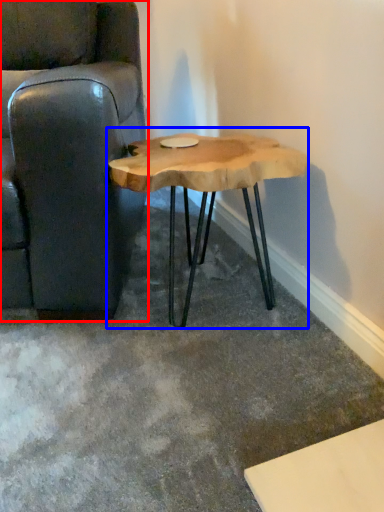
Question: Which object appears closest to the camera in this image, chair (highlighted by a red box) or coffee table (highlighted by a blue box)?

Choices:
 (A) chair
 (B) coffee table

Answer: (A)